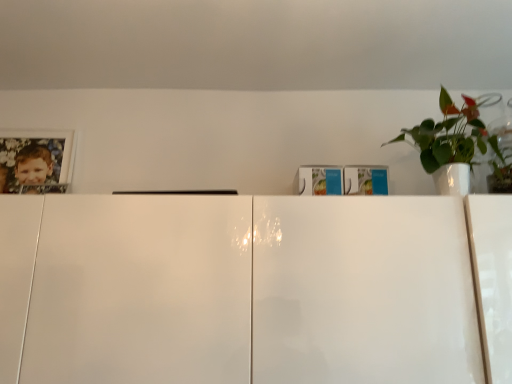
The image size is (512, 384). Describe the element at coordinates (451, 136) in the screenshot. I see `white glossy pot at upper right` at that location.

Locate an element on the screen. This screenshot has width=512, height=384. white glossy pot at upper right is located at coordinates (451, 136).

What do you see at coordinates (36, 161) in the screenshot? The height and width of the screenshot is (384, 512). I see `white glossy picture frame at upper left` at bounding box center [36, 161].

I want to click on white glossy picture frame at upper left, so click(36, 161).

Measure the distance between point [34,146] and camera.

Point [34,146] is 5.55 feet from camera.

What are the coordinates of `white glossy pot at upper right` in the screenshot? It's located at (451, 136).

Considering the positions of objects white glossy picture frame at upper left and white glossy pot at upper right in the image provided, who is more to the left, white glossy picture frame at upper left or white glossy pot at upper right?

Positioned to the left is white glossy picture frame at upper left.

Which is behind, white glossy picture frame at upper left or white glossy pot at upper right?

Positioned behind is white glossy picture frame at upper left.

Does point (0, 170) come farther from viewer compared to point (441, 192)?

That is True.

From the image's perspective, relative to white glossy pot at upper right, is white glossy picture frame at upper left above or below?

Clearly, from the image's perspective, white glossy picture frame at upper left is below white glossy pot at upper right.

From a real-world perspective, is white glossy picture frame at upper left located beneath white glossy pot at upper right?

No.

Does white glossy picture frame at upper left have a greater width compared to white glossy pot at upper right?

Incorrect, the width of white glossy picture frame at upper left does not surpass that of white glossy pot at upper right.

Can you confirm if white glossy picture frame at upper left is taller than white glossy pot at upper right?

Yes, white glossy picture frame at upper left is taller than white glossy pot at upper right.

Looking at the image, does white glossy picture frame at upper left seem bigger or smaller compared to white glossy pot at upper right?

Considering their sizes, white glossy picture frame at upper left takes up less space than white glossy pot at upper right.

Is white glossy picture frame at upper left located outside white glossy pot at upper right?

Absolutely, white glossy picture frame at upper left is external to white glossy pot at upper right.

Does white glossy picture frame at upper left touch white glossy pot at upper right?

No, white glossy picture frame at upper left is not making contact with white glossy pot at upper right.

Is white glossy picture frame at upper left aimed at white glossy pot at upper right?

No, white glossy picture frame at upper left is not aimed at white glossy pot at upper right.

What's the angular difference between white glossy picture frame at upper left and white glossy pot at upper right's facing directions?

They differ by 2.36 degrees in their facing directions.

Measure the distance from white glossy picture frame at upper left to white glossy pot at upper right.

white glossy picture frame at upper left is 4.58 feet away from white glossy pot at upper right.

Identify the location of houseplant beneath the white glossy picture frame at upper left (from a real-world perspective). (451, 136).

Does white glossy pot at upper right appear on the left side of white glossy picture frame at upper left?

Answer: No.

Which is in front, white glossy pot at upper right or white glossy picture frame at upper left?

Positioned in front is white glossy pot at upper right.

Which is behind, point (436, 151) or point (2, 181)?

The point (2, 181) is behind.

From the image's perspective, which is above, white glossy pot at upper right or white glossy picture frame at upper left?

From the image's view, white glossy pot at upper right is above.

From a real-world perspective, which object stands above the other?

white glossy picture frame at upper left, from a real-world perspective.

Does white glossy pot at upper right have a lesser width compared to white glossy picture frame at upper left?

In fact, white glossy pot at upper right might be wider than white glossy picture frame at upper left.

Considering the relative sizes of white glossy pot at upper right and white glossy picture frame at upper left in the image provided, is white glossy pot at upper right taller than white glossy picture frame at upper left?

No, white glossy pot at upper right is not taller than white glossy picture frame at upper left.

Based on their sizes in the image, would you say white glossy pot at upper right is bigger or smaller than white glossy picture frame at upper left?

Considering their sizes, white glossy pot at upper right takes up more space than white glossy picture frame at upper left.

Is white glossy pot at upper right inside the boundaries of white glossy picture frame at upper left, or outside?

white glossy pot at upper right is outside white glossy picture frame at upper left.

Is white glossy pot at upper right placed right next to white glossy picture frame at upper left?

No, white glossy pot at upper right is not making contact with white glossy picture frame at upper left.

Is white glossy pot at upper right oriented towards white glossy picture frame at upper left?

No, white glossy pot at upper right is not facing towards white glossy picture frame at upper left.

You are a GUI agent. You are given a task and a screenshot of the screen. Output one action in this format:
    pyautogui.click(x=<x>, y=<y>)
    Task: Click on the houseplant that is in front of the white glossy picture frame at upper left
    
    Given the screenshot: What is the action you would take?
    pyautogui.click(x=451, y=136)

The height and width of the screenshot is (384, 512). What are the coordinates of `houseplant that appears on the right of white glossy picture frame at upper left` in the screenshot? It's located at click(x=451, y=136).

Locate an element on the screen. picture frame below the white glossy pot at upper right (from the image's perspective) is located at coordinates (36, 161).